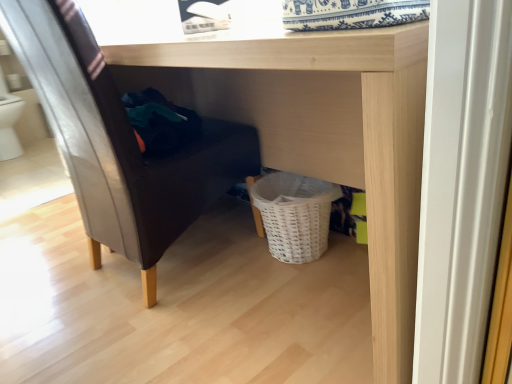
The height and width of the screenshot is (384, 512). I want to click on vacant area in front of matte black chair at left, so click(128, 341).